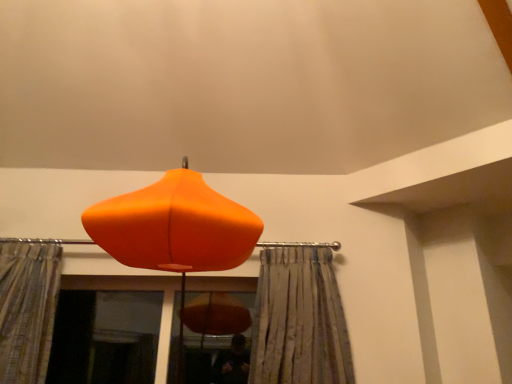
Question: Would you say transparent glass screen door at lower left is outside orange matte lampshade at center?

Choices:
 (A) no
 (B) yes

Answer: (B)

Question: Is the depth of transparent glass screen door at lower left greater than that of orange matte lampshade at center?

Choices:
 (A) yes
 (B) no

Answer: (A)

Question: Is transparent glass screen door at lower left in contact with orange matte lampshade at center?

Choices:
 (A) yes
 (B) no

Answer: (B)

Question: From a real-world perspective, is transparent glass screen door at lower left under orange matte lampshade at center?

Choices:
 (A) no
 (B) yes

Answer: (B)

Question: Does transparent glass screen door at lower left lie in front of orange matte lampshade at center?

Choices:
 (A) no
 (B) yes

Answer: (A)

Question: From a real-world perspective, is silky gray curtain at center, the first curtain when ordered from right to left, above or below textured beige curtain at left, which appears as the 1th curtain when viewed from the left?

Choices:
 (A) below
 (B) above

Answer: (A)

Question: Is point [265, 352] closer or farther from the camera than point [15, 367]?

Choices:
 (A) farther
 (B) closer

Answer: (A)

Question: Is silky gray curtain at center, the first curtain when ordered from right to left, bigger or smaller than textured beige curtain at left, the second curtain positioned from the right?

Choices:
 (A) big
 (B) small

Answer: (A)

Question: Considering the relative positions of silky gray curtain at center, the first curtain when ordered from right to left, and textured beige curtain at left, which appears as the 1th curtain when viewed from the left, in the image provided, is silky gray curtain at center, the first curtain when ordered from right to left, to the left or to the right of textured beige curtain at left, which appears as the 1th curtain when viewed from the left,?

Choices:
 (A) left
 (B) right

Answer: (B)

Question: Is textured beige curtain at left, the second curtain positioned from the right, inside or outside of transparent glass screen door at lower left?

Choices:
 (A) outside
 (B) inside

Answer: (A)

Question: Looking at their shapes, would you say textured beige curtain at left, the second curtain positioned from the right, is wider or thinner than transparent glass screen door at lower left?

Choices:
 (A) wide
 (B) thin

Answer: (A)

Question: From a real-world perspective, is textured beige curtain at left, which appears as the 1th curtain when viewed from the left, physically located above or below transparent glass screen door at lower left?

Choices:
 (A) above
 (B) below

Answer: (A)

Question: Is textured beige curtain at left, the second curtain positioned from the right, in front of or behind transparent glass screen door at lower left in the image?

Choices:
 (A) behind
 (B) front

Answer: (B)

Question: Would you say transparent glass screen door at lower left is to the left or to the right of silky gray curtain at center, the first curtain when ordered from right to left, in the picture?

Choices:
 (A) right
 (B) left

Answer: (B)

Question: Considering the positions of transparent glass screen door at lower left and silky gray curtain at center, the first curtain when ordered from right to left, in the image, is transparent glass screen door at lower left taller or shorter than silky gray curtain at center, the first curtain when ordered from right to left,?

Choices:
 (A) short
 (B) tall

Answer: (A)